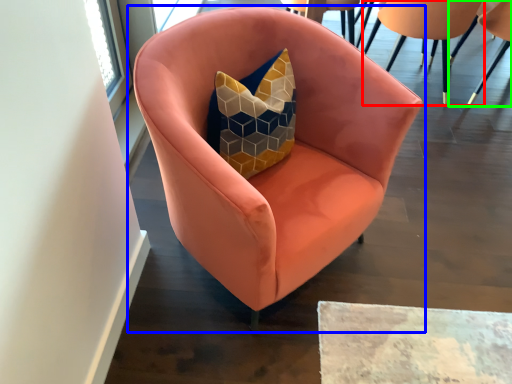
Question: Which object is positioned farthest from chair (highlighted by a red box)? Select from chair (highlighted by a blue box) and chair (highlighted by a green box).

Choices:
 (A) chair
 (B) chair

Answer: (A)